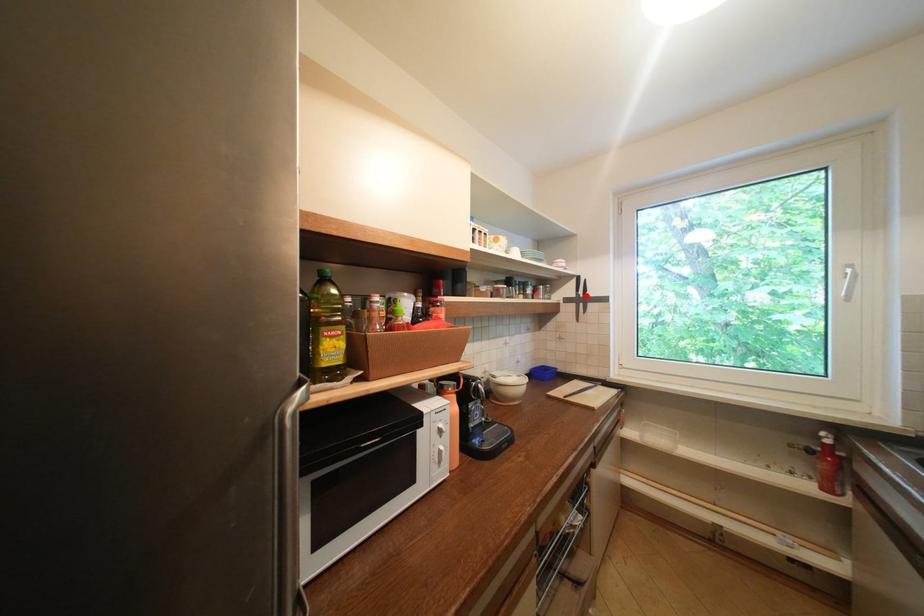
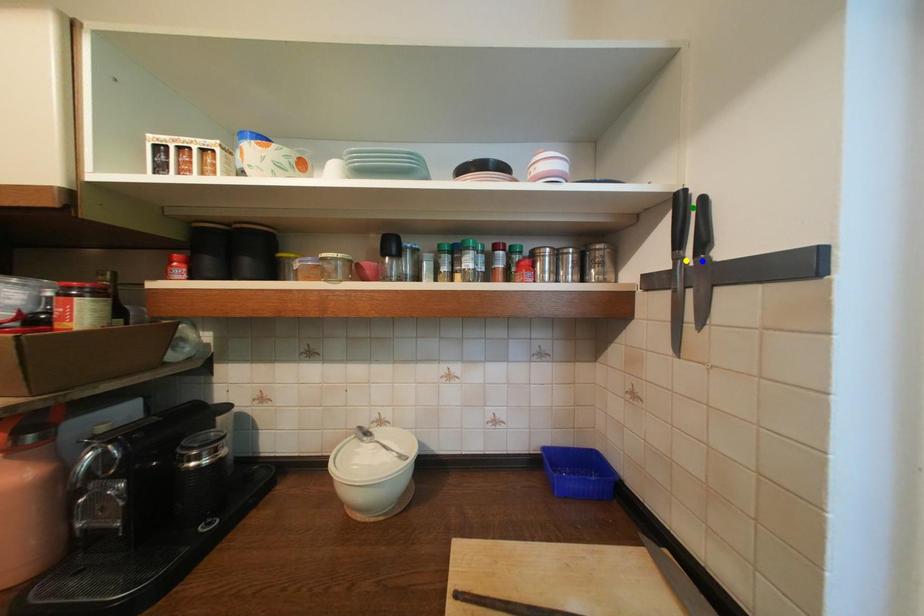
Question: I am providing you with two images of the same scene from different viewpoints. A red point is marked on the first image. You are given multiple points on the second image. Which point in image 2 represents the same 3d spot as the red point in image 1?

Choices:
 (A) yellow point
 (B) blue point
 (C) green point

Answer: (A)